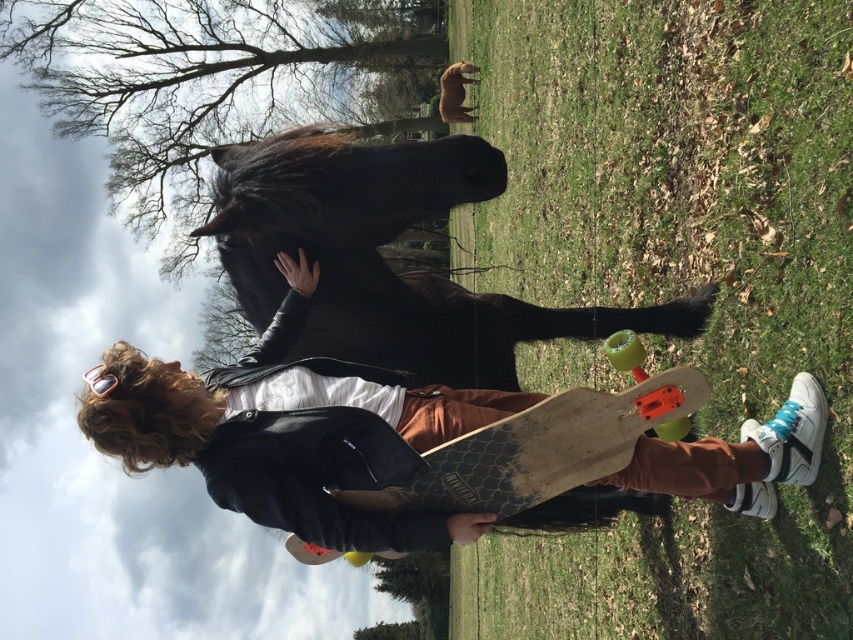
Question: Which object is farther from the camera taking this photo?

Choices:
 (A) wooden textured skateboard at center
 (B) black glossy horse at center
 (C) wooden skateboard at center

Answer: (B)

Question: Does wooden skateboard at center appear on the right side of wooden textured skateboard at center?

Choices:
 (A) no
 (B) yes

Answer: (A)

Question: Observing the image, what is the correct spatial positioning of black glossy horse at center in reference to wooden textured skateboard at center?

Choices:
 (A) left
 (B) right

Answer: (A)

Question: Which is farther from the black glossy horse at center?

Choices:
 (A) wooden textured skateboard at center
 (B) wooden skateboard at center

Answer: (A)

Question: Estimate the real-world distances between objects in this image. Which object is closer to the wooden textured skateboard at center?

Choices:
 (A) black glossy horse at center
 (B) wooden skateboard at center

Answer: (B)

Question: Is black glossy horse at center to the left of wooden textured skateboard at center from the viewer's perspective?

Choices:
 (A) no
 (B) yes

Answer: (B)